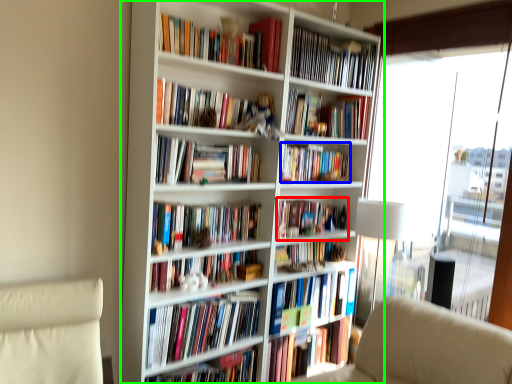
Question: Which object is the farthest from book (highlighted by a red box)? Choose among these: book (highlighted by a blue box) or bookcase (highlighted by a green box).

Choices:
 (A) book
 (B) bookcase

Answer: (B)